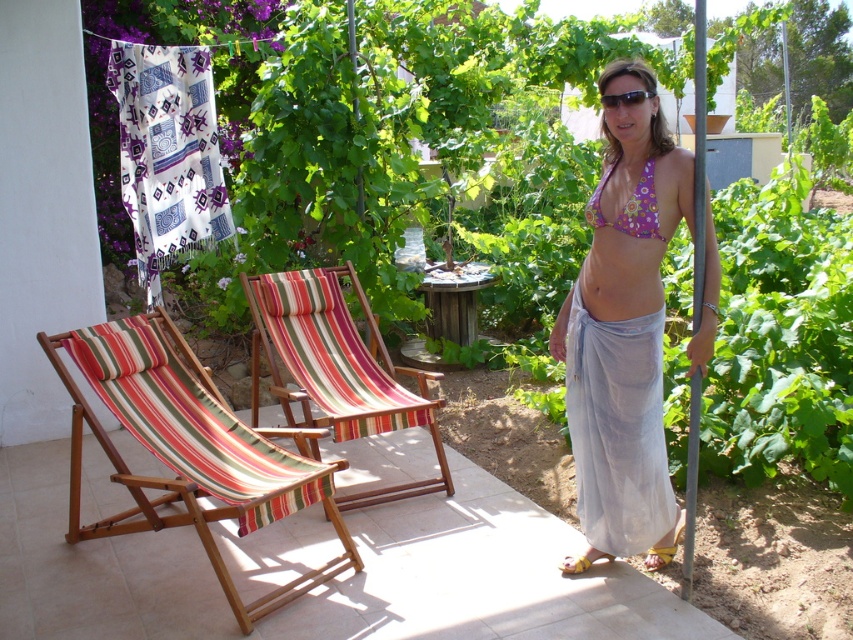
In the scene shown: You are standing at the point marked as point [624,337]. Looking around, you see a woman in a purple bikini top and a flowing white sarong. What is the nearest object to you?

The nearest object to you is the floral bikini top at center, as the point [624,337] is located on it.

You are a photographer setting up a shoot in this outdoor area. You need to position a small prop between the striped fabric beach chair at left and the sunglasses at center. Where should you place it to ensure it is between them spatially?

The striped fabric beach chair at left is located below the sunglasses at center, so placing the prop between them would require positioning it above the chair and below the sunglasses.

You are standing at the camera position and want to place a small decoration between the two points labeled point (598, 236) and point (334, 397). Which point should the decoration be closer to in order to appear larger in the photo?

The decoration should be placed closer to point (598, 236) because it is closer to the camera than point (334, 397), making objects near it appear larger in the photo.